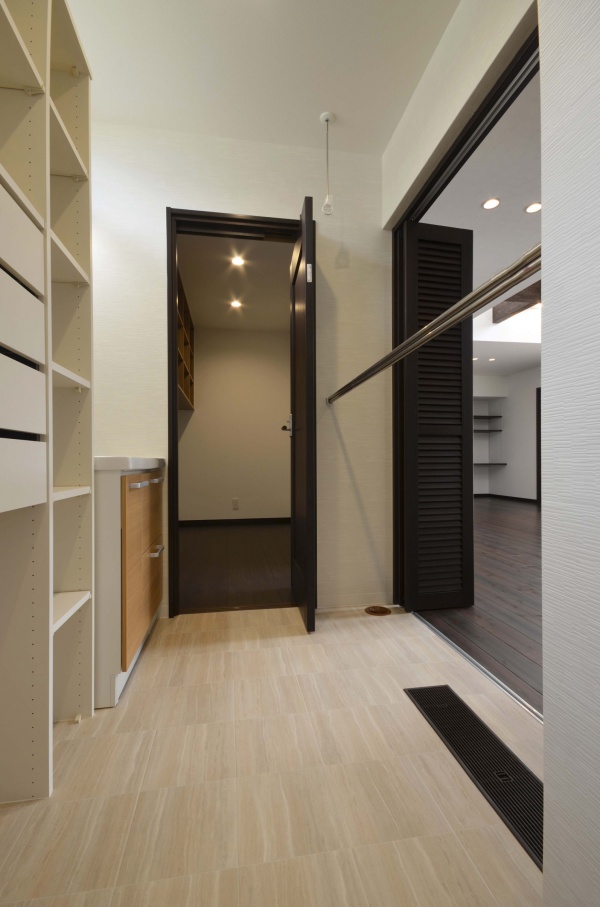
Find the location of `recessed lighting`. recessed lighting is located at coordinates (490, 357), (475, 356), (491, 205), (535, 209), (237, 261), (234, 304).